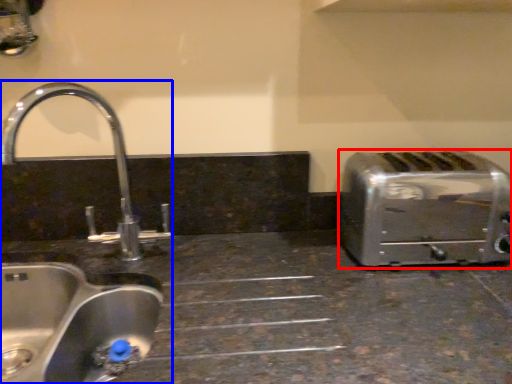
Question: Which object is further to the camera taking this photo, toaster (highlighted by a red box) or sink (highlighted by a blue box)?

Choices:
 (A) toaster
 (B) sink

Answer: (A)